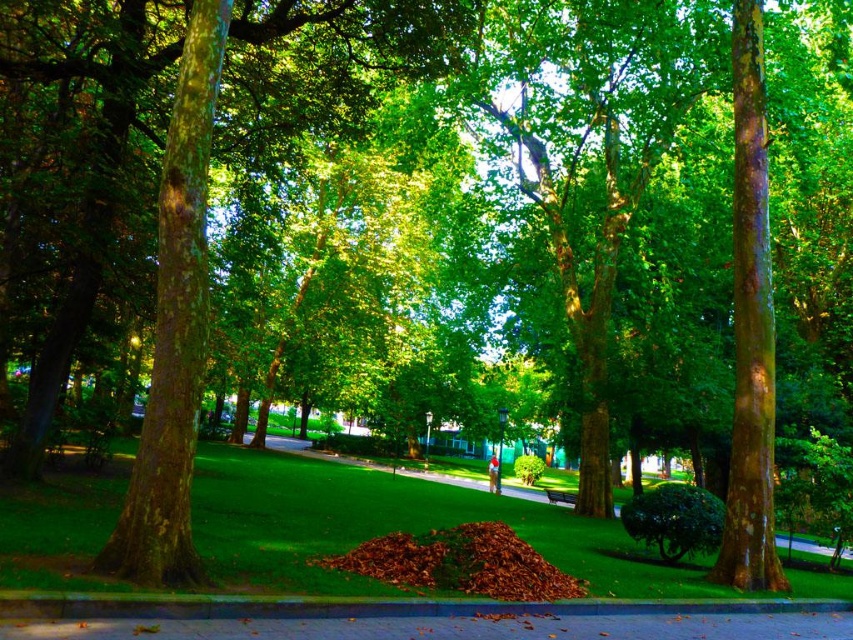
Consider the image. Does green grass at center appear under green wooden bench at center?

No, green grass at center is not below green wooden bench at center.

Does green grass at center have a smaller size compared to green wooden bench at center?

Actually, green grass at center might be larger than green wooden bench at center.

Is point (390, 490) farther from camera compared to point (548, 500)?

No, (390, 490) is in front of (548, 500).

The height and width of the screenshot is (640, 853). In order to click on green grass at center in this screenshot , I will do `click(392, 525)`.